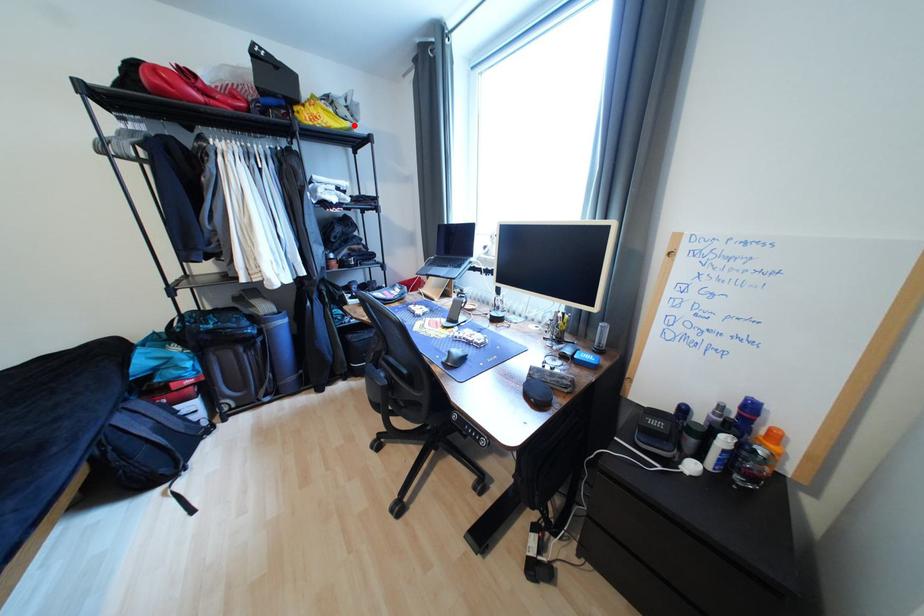
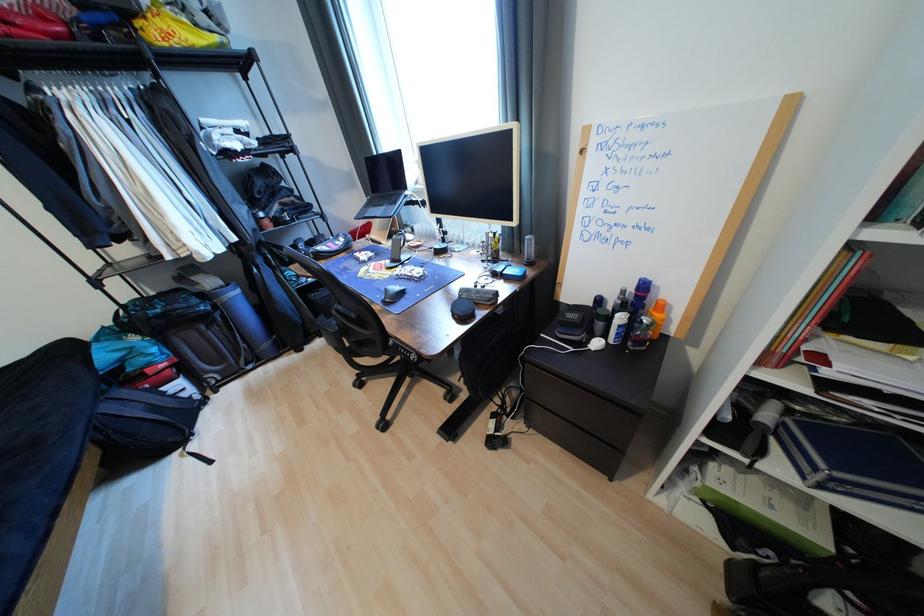
Question: I am providing you with two images of the same scene from different viewpoints. Image1 has a red point marked. In image2, the corresponding 3D location appears at what relative position? Reply with the corresponding letter.

Choices:
 (A) Closer
 (B) Farther

Answer: (B)